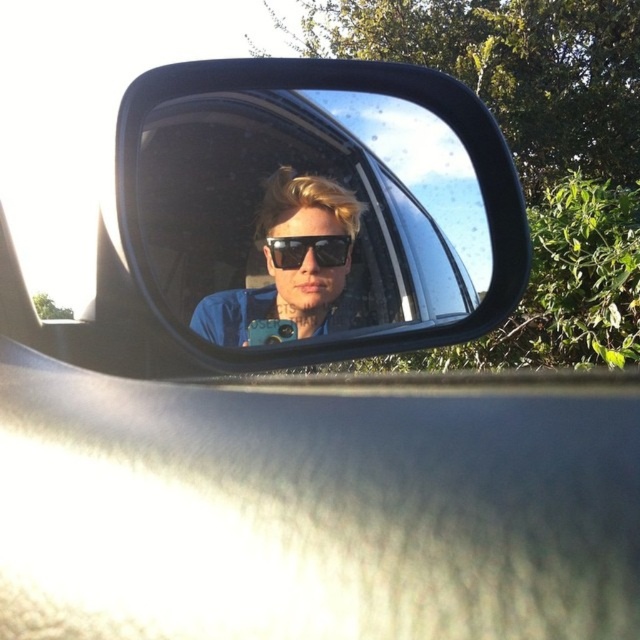
Which of these two, sunglasses at center or black plastic sunglasses at center, stands taller?

sunglasses at center is taller.

Who is positioned more to the right, sunglasses at center or black plastic sunglasses at center?

Positioned to the right is black plastic sunglasses at center.

I want to click on sunglasses at center, so click(x=292, y=262).

You are a GUI agent. You are given a task and a screenshot of the screen. Output one action in this format:
    pyautogui.click(x=<x>, y=<y>)
    Task: Click on the sunglasses at center
    
    Given the screenshot: What is the action you would take?
    pyautogui.click(x=292, y=262)

Is black plastic mirror at center to the left of black plastic sunglasses at center from the viewer's perspective?

In fact, black plastic mirror at center is to the right of black plastic sunglasses at center.

The height and width of the screenshot is (640, 640). I want to click on black plastic mirror at center, so click(316, 209).

The image size is (640, 640). What are the coordinates of `black plastic mirror at center` in the screenshot? It's located at (316, 209).

Does black plastic mirror at center have a smaller size compared to sunglasses at center?

No, black plastic mirror at center is not smaller than sunglasses at center.

Does point (396, 348) come farther from viewer compared to point (196, 321)?

Yes.

Where is `black plastic mirror at center`? black plastic mirror at center is located at coordinates (316, 209).